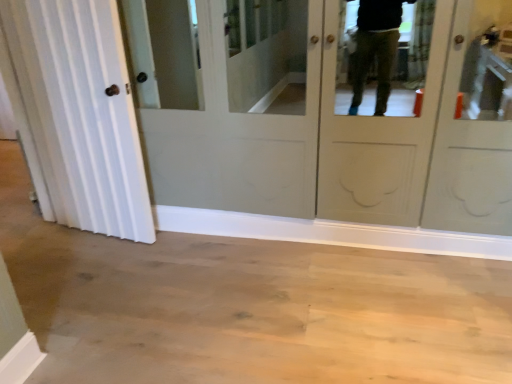
This screenshot has width=512, height=384. Describe the element at coordinates (77, 114) in the screenshot. I see `white textured curtain at left` at that location.

Locate an element on the screen. This screenshot has width=512, height=384. white textured curtain at left is located at coordinates (x=77, y=114).

Identify the location of white textured curtain at left. The width and height of the screenshot is (512, 384). (77, 114).